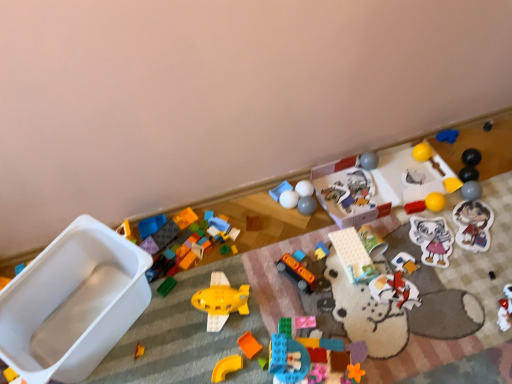
Where is `unoccupied area behind orange matte block at center, acting as the sixth toy starting from the left`? unoccupied area behind orange matte block at center, acting as the sixth toy starting from the left is located at coordinates (254, 299).